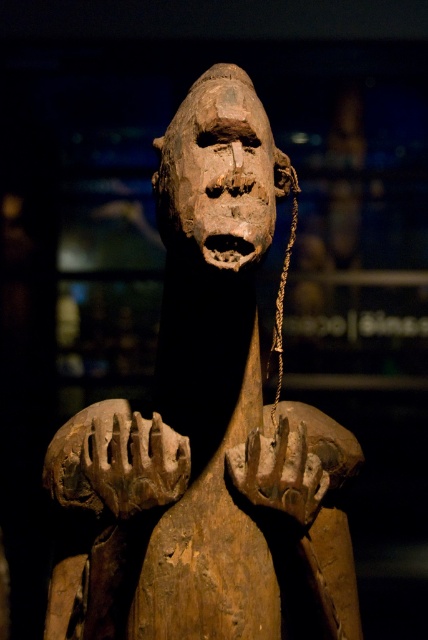
Question: Among these objects, which one is farthest from the camera?

Choices:
 (A) wooden statue at center
 (B) wooden mask at center

Answer: (A)

Question: Can you confirm if wooden statue at center is positioned to the left of wooden mask at center?

Choices:
 (A) no
 (B) yes

Answer: (A)

Question: Where is wooden statue at center located in relation to wooden mask at center in the image?

Choices:
 (A) right
 (B) left

Answer: (A)

Question: Which of the following is the closest to the observer?

Choices:
 (A) wooden statue at center
 (B) wooden mask at center

Answer: (B)

Question: Is wooden statue at center bigger than wooden mask at center?

Choices:
 (A) yes
 (B) no

Answer: (A)

Question: Which point is farther to the camera?

Choices:
 (A) (187, 108)
 (B) (163, 554)

Answer: (A)